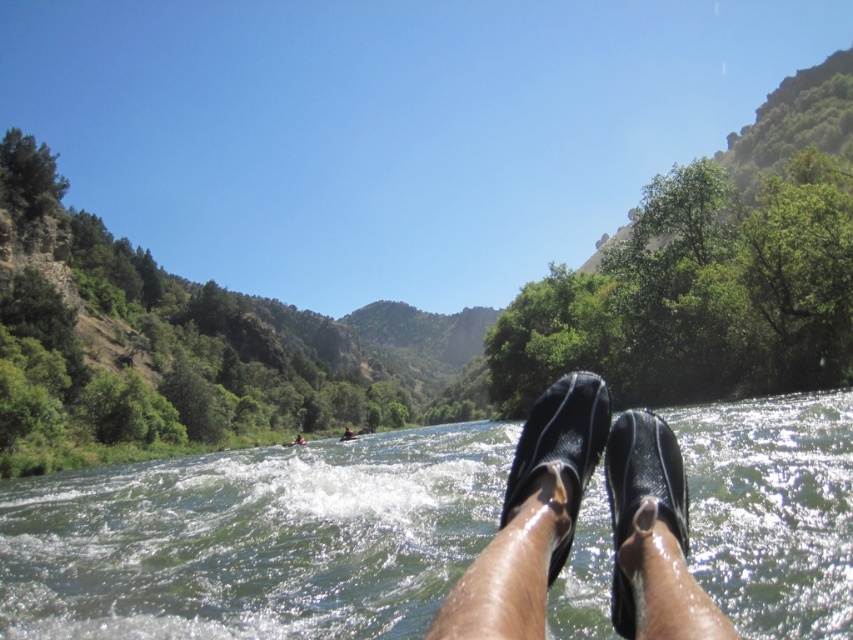
Between green rubber boots at lower center and black rubber sandals at center, which one has more height?

green rubber boots at lower center is taller.

Which is more to the left, green rubber boots at lower center or black rubber sandals at center?

Positioned to the left is green rubber boots at lower center.

Who is more distant from viewer, (398, 563) or (614, 422)?

The point (398, 563) is more distant.

Identify the location of green rubber boots at lower center. click(x=254, y=538).

Between green rubber boots at lower center and brown leather kayak at center, which one appears on the left side from the viewer's perspective?

Positioned to the left is brown leather kayak at center.

Can you confirm if green rubber boots at lower center is positioned to the right of brown leather kayak at center?

Indeed, green rubber boots at lower center is positioned on the right side of brown leather kayak at center.

Does point (172, 547) come behind point (352, 435)?

No, it is not.

At what (x,y) coordinates should I click in order to perform the action: click on green rubber boots at lower center. Please return your answer as a coordinate pair (x, y). The height and width of the screenshot is (640, 853). Looking at the image, I should click on (254, 538).

Is green rubber boots at lower center wider than black rubber flip-flop at lower center?

Yes, green rubber boots at lower center is wider than black rubber flip-flop at lower center.

Find the location of a particular element. green rubber boots at lower center is located at coordinates (254, 538).

Identify the location of green rubber boots at lower center. The image size is (853, 640). (254, 538).